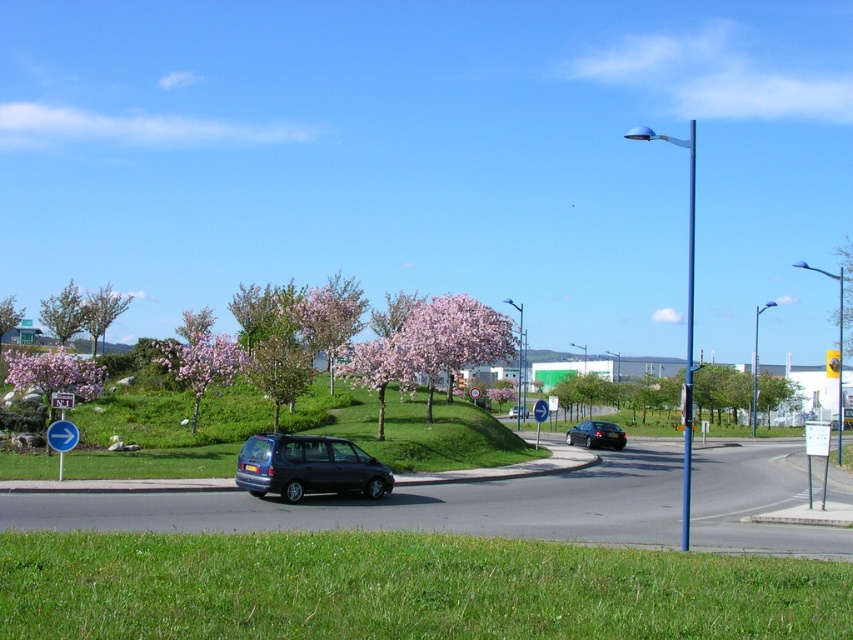
You are driving a matte black van at center and want to park it near the green leafy tree at center. Based on their positions, which direction should you turn to move closer to the tree?

The green leafy tree at center is to the right of the matte black van at center, so you should turn right to move closer to the tree.